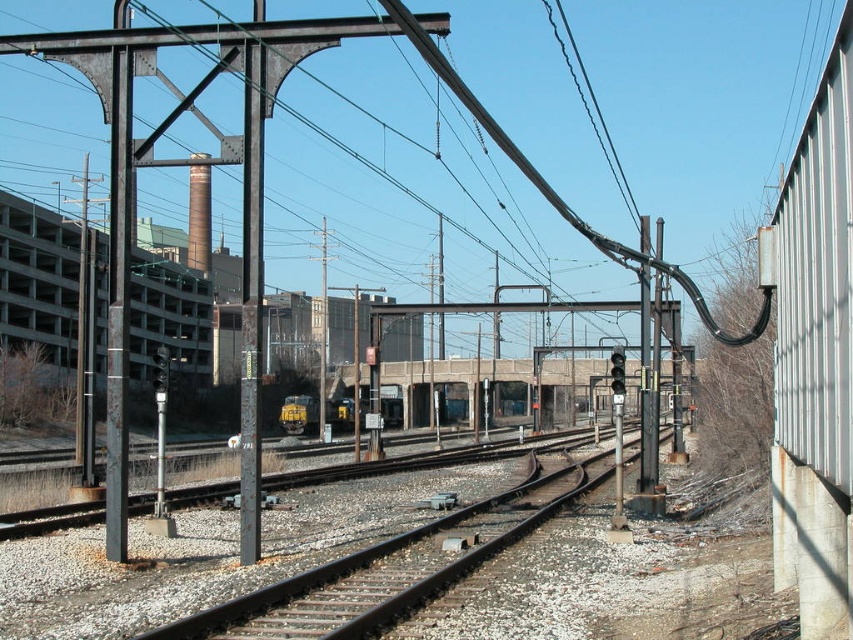
You are a train engineer observing the railway tracks. There are two points marked on your map at coordinates point [105,481] and point [248,419]. Which point is closer to the train if it is currently positioned at the front of the tracks?

Point [248,419] is closer to the train because it is in front of point [105,481], which is behind it.

You are standing at the center of the railway tracks in the image. Which direction should you walk to reach the rusty metal pole at left?

You should walk to the left to reach the rusty metal pole at left since it is located at the left side of the image.

You are a maintenance worker inspecting the railway tracks. You notice the rusty metal pole at center and the black wire at upper center. Which object is closer to you from your vantage point?

The rusty metal pole at center is closer to you because it is in front of the black wire at upper center.